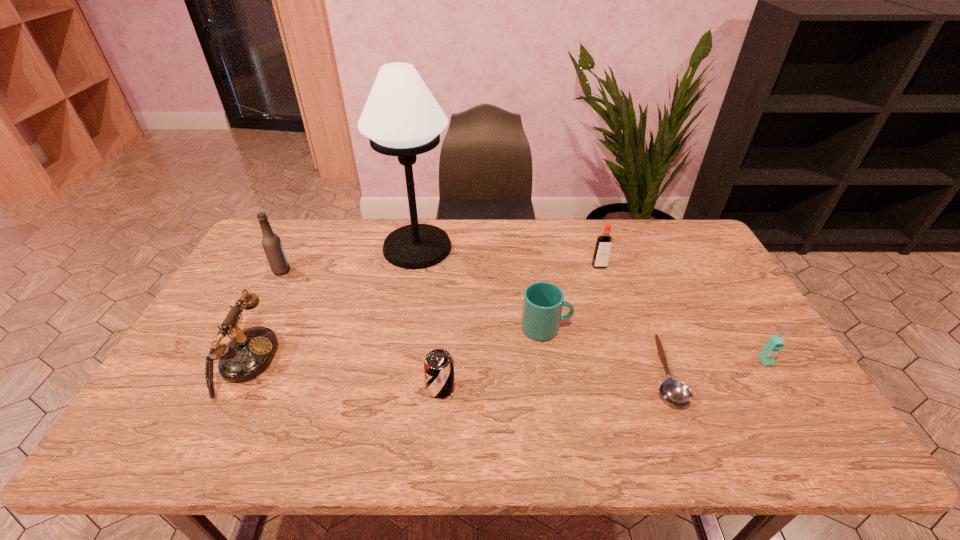
Locate an element on the screen. The width and height of the screenshot is (960, 540). vacant position located 0.150m on the side of the second tallest object with the label is located at coordinates (336, 271).

Identify the location of free region located 0.230m on the front and back of the vodka. (617, 320).

This screenshot has width=960, height=540. Identify the location of vacant space situated on the dial of the telephone. pyautogui.click(x=406, y=362).

Identify the location of vacant space located 0.230m on the handle side of the cup. The height and width of the screenshot is (540, 960). (652, 328).

I want to click on free space located 0.070m on the keypad of the rightmost object, so click(x=782, y=389).

The height and width of the screenshot is (540, 960). What are the coordinates of `free space located 0.360m on the back of the soda can` in the screenshot? It's located at (449, 282).

The width and height of the screenshot is (960, 540). What are the coordinates of `vacant space located on the back of the ladle` in the screenshot? It's located at (624, 268).

Image resolution: width=960 pixels, height=540 pixels. What are the coordinates of `object positioned at the far edge` in the screenshot? It's located at (401, 117).

This screenshot has width=960, height=540. Find the location of `beer bottle located in the left edge section of the desktop`. beer bottle located in the left edge section of the desktop is located at coordinates (272, 245).

Locate an element on the screen. This screenshot has height=540, width=960. telephone situated at the left edge is located at coordinates (248, 353).